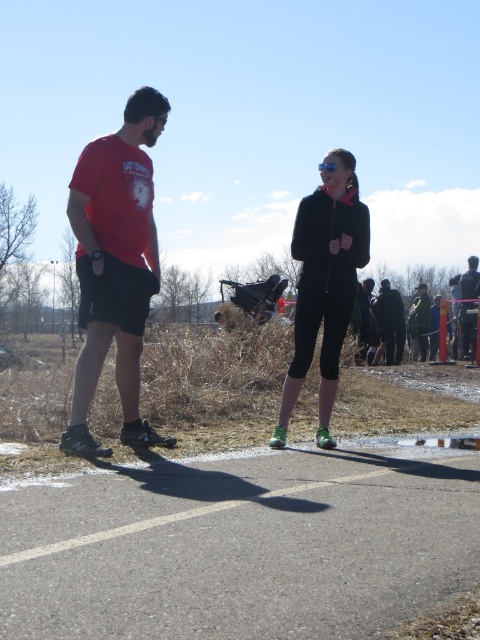
You are a photographer trying to capture the black fleece jacket at center in the image. The camera you are using has a rectangular viewfinder with coordinates ranging from 0 to 1 on both the x and y axes. The point given is at coordinates (324,284). Can you confirm if this point is within the viewfinder area?

Yes, the point at coordinates (324,284) is within the viewfinder area since it falls between 0 and 1 on both the x and y axes.